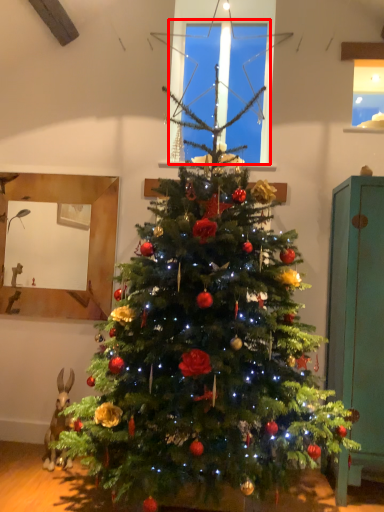
Question: In this image, where is window screen (annotated by the red box) located relative to armoire?

Choices:
 (A) right
 (B) left

Answer: (B)